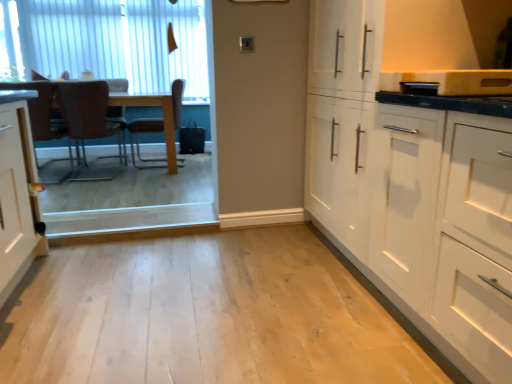
The image size is (512, 384). What do you see at coordinates (413, 186) in the screenshot?
I see `white matte cabinet at right` at bounding box center [413, 186].

Describe the element at coordinates (39, 109) in the screenshot. I see `brown leather chair at left, which is counted as the third chair, starting from the right` at that location.

The image size is (512, 384). Describe the element at coordinates (89, 124) in the screenshot. I see `brown leather chair at left, which is counted as the second chair, starting from the right` at that location.

What is the approximate width of brown leather chair at center, the first chair viewed from the right?

It is 24.19 inches.

Locate an element on the screen. This screenshot has width=512, height=384. white matte cabinet at right is located at coordinates (413, 186).

How far apart are light wood floor at center and brown leather chair at center, placed as the 3th chair when sorted from left to right?

A distance of 8.27 feet exists between light wood floor at center and brown leather chair at center, placed as the 3th chair when sorted from left to right.

From a real-world perspective, which is physically above, light wood floor at center or brown leather chair at center, the first chair viewed from the right?

In real-world perspective, brown leather chair at center, the first chair viewed from the right, is above.

Looking at this image, is light wood floor at center at the left side of brown leather chair at center, the first chair viewed from the right?

No, light wood floor at center is not to the left of brown leather chair at center, the first chair viewed from the right.

Considering the sizes of light wood floor at center and brown leather chair at center, placed as the 3th chair when sorted from left to right, in the image, is light wood floor at center taller or shorter than brown leather chair at center, placed as the 3th chair when sorted from left to right,?

In the image, light wood floor at center appears to be shorter than brown leather chair at center, placed as the 3th chair when sorted from left to right.

Consider the image. Considering the positions of objects white matte cabinet at right and brown fabric armchair at left in the image provided, who is behind, white matte cabinet at right or brown fabric armchair at left?

brown fabric armchair at left is further away from the camera.

Which is behind, point (344, 62) or point (119, 80)?

Point (119, 80)

Considering the sizes of white matte cabinet at right and brown fabric armchair at left in the image, is white matte cabinet at right taller or shorter than brown fabric armchair at left?

Considering their sizes, white matte cabinet at right has more height than brown fabric armchair at left.

Considering the relative sizes of white matte cabinet at right and brown fabric armchair at left in the image provided, is white matte cabinet at right bigger than brown fabric armchair at left?

Correct, white matte cabinet at right is larger in size than brown fabric armchair at left.

Who is smaller, white matte cabinet at right or brown leather chair at left, which is counted as the third chair, starting from the right?

brown leather chair at left, which is counted as the third chair, starting from the right.

From the image's perspective, is white matte cabinet at right located beneath brown leather chair at left, which is counted as the third chair, starting from the right?

Correct, white matte cabinet at right appears lower than brown leather chair at left, which is counted as the third chair, starting from the right, in the image.

Looking at this image, is white matte cabinet at right positioned far away from brown leather chair at left, which is counted as the third chair, starting from the right?

Yes, white matte cabinet at right is far from brown leather chair at left, which is counted as the third chair, starting from the right.

Is white matte cabinet at right shorter than brown leather chair at left, which is counted as the 1th chair, starting from the left?

Incorrect, the height of white matte cabinet at right does not fall short of that of brown leather chair at left, which is counted as the 1th chair, starting from the left.

Is white matte cabinet at right touching brown leather chair at center, placed as the 3th chair when sorted from left to right?

There is a gap between white matte cabinet at right and brown leather chair at center, placed as the 3th chair when sorted from left to right.

From a real-world perspective, which object rests below the other?

From a 3D spatial view, brown leather chair at center, placed as the 3th chair when sorted from left to right, is below.

Does point (115, 169) lie behind point (132, 134)?

Yes, it is.

From a real-world perspective, is brown leather chair at left, which is counted as the second chair, starting from the right, on top of brown leather chair at center, the first chair viewed from the right?

Yes, from a real-world perspective, brown leather chair at left, which is counted as the second chair, starting from the right, is on top of brown leather chair at center, the first chair viewed from the right.

Between brown leather chair at left, which is counted as the second chair, starting from the right, and brown leather chair at center, the first chair viewed from the right, which one is positioned in front?

Positioned in front is brown leather chair at left, which is counted as the second chair, starting from the right.

Find the location of `chair on the right side of brown leather chair at left, the 2th chair viewed from the left`. chair on the right side of brown leather chair at left, the 2th chair viewed from the left is located at coordinates (144, 132).

Looking at the image, does white vertical blinds at upper left seem bigger or smaller compared to brown leather chair at left, the 2th chair viewed from the left?

Clearly, white vertical blinds at upper left is smaller in size than brown leather chair at left, the 2th chair viewed from the left.

Which of these two, white vertical blinds at upper left or brown leather chair at left, which is counted as the second chair, starting from the right, stands shorter?

brown leather chair at left, which is counted as the second chair, starting from the right.

Are white vertical blinds at upper left and brown leather chair at left, the 2th chair viewed from the left, located far from each other?

Indeed, white vertical blinds at upper left is not near brown leather chair at left, the 2th chair viewed from the left.

Is brown leather chair at center, placed as the 3th chair when sorted from left to right, facing away from light wood floor at center?

No, brown leather chair at center, placed as the 3th chair when sorted from left to right, is not facing away from light wood floor at center.

Measure the distance from brown leather chair at center, placed as the 3th chair when sorted from left to right, to light wood floor at center.

brown leather chair at center, placed as the 3th chair when sorted from left to right, is 8.27 feet away from light wood floor at center.

From the picture: Considering the positions of objects brown leather chair at center, placed as the 3th chair when sorted from left to right, and light wood floor at center in the image provided, who is more to the right, brown leather chair at center, placed as the 3th chair when sorted from left to right, or light wood floor at center?

Positioned to the right is light wood floor at center.

Can you see brown leather chair at center, placed as the 3th chair when sorted from left to right, touching light wood floor at center?

There is a gap between brown leather chair at center, placed as the 3th chair when sorted from left to right, and light wood floor at center.

Image resolution: width=512 pixels, height=384 pixels. What are the coordinates of `plain on the right side of brown leather chair at center, placed as the 3th chair when sorted from left to right` in the screenshot? It's located at (203, 315).

You are a GUI agent. You are given a task and a screenshot of the screen. Output one action in this format:
    pyautogui.click(x=<x>, y=<y>)
    Task: Click on the armchair below the white matte cabinet at right (from a real-world perspective)
    The height and width of the screenshot is (384, 512).
    Given the screenshot: What is the action you would take?
    pyautogui.click(x=116, y=114)

Based on their spatial positions, is white vertical blinds at upper left or brown leather chair at left, the 2th chair viewed from the left, closer to brown leather chair at center, placed as the 3th chair when sorted from left to right?

brown leather chair at left, the 2th chair viewed from the left, is closer to brown leather chair at center, placed as the 3th chair when sorted from left to right.

Looking at this image, when comparing their distances from brown leather chair at left, which is counted as the 1th chair, starting from the left, does brown fabric armchair at left or light wood floor at center seem closer?

Among the two, brown fabric armchair at left is located nearer to brown leather chair at left, which is counted as the 1th chair, starting from the left.

Based on their spatial positions, is brown leather chair at left, which is counted as the third chair, starting from the right, or brown fabric armchair at left closer to white vertical blinds at upper left?

Based on the image, brown fabric armchair at left appears to be nearer to white vertical blinds at upper left.

Looking at the image, which one is located closer to brown leather chair at center, the first chair viewed from the right, white matte cabinet at right or light wood floor at center?

light wood floor at center is positioned closer to the anchor brown leather chair at center, the first chair viewed from the right.

Estimate the real-world distances between objects in this image. Which object is closer to brown leather chair at left, which is counted as the second chair, starting from the right, light wood floor at center or white vertical blinds at upper left?

white vertical blinds at upper left.

Based on their spatial positions, is brown leather chair at center, placed as the 3th chair when sorted from left to right, or light wood floor at center further from white vertical blinds at upper left?

light wood floor at center.

Looking at the image, which one is located closer to brown fabric armchair at left, white vertical blinds at upper left or brown leather chair at left, which is counted as the second chair, starting from the right?

Result: brown leather chair at left, which is counted as the second chair, starting from the right, lies closer to brown fabric armchair at left than the other object.

Based on their spatial positions, is brown fabric armchair at left or light wood floor at center further from white vertical blinds at upper left?

light wood floor at center.

At what (x,y) coordinates should I click in order to perform the action: click on armchair between light wood floor at center and white vertical blinds at upper left in the front-back direction. Please return your answer as a coordinate pair (x, y). Looking at the image, I should click on (116, 114).

The width and height of the screenshot is (512, 384). I want to click on chair between white vertical blinds at upper left and brown leather chair at left, which is counted as the second chair, starting from the right, in the vertical direction, so click(144, 132).

This screenshot has height=384, width=512. In order to click on armchair that lies between white vertical blinds at upper left and brown leather chair at center, placed as the 3th chair when sorted from left to right, from top to bottom in this screenshot , I will do 116,114.

Locate an element on the screen. This screenshot has width=512, height=384. cabinetry located between light wood floor at center and brown fabric armchair at left in the depth direction is located at coordinates (413, 186).